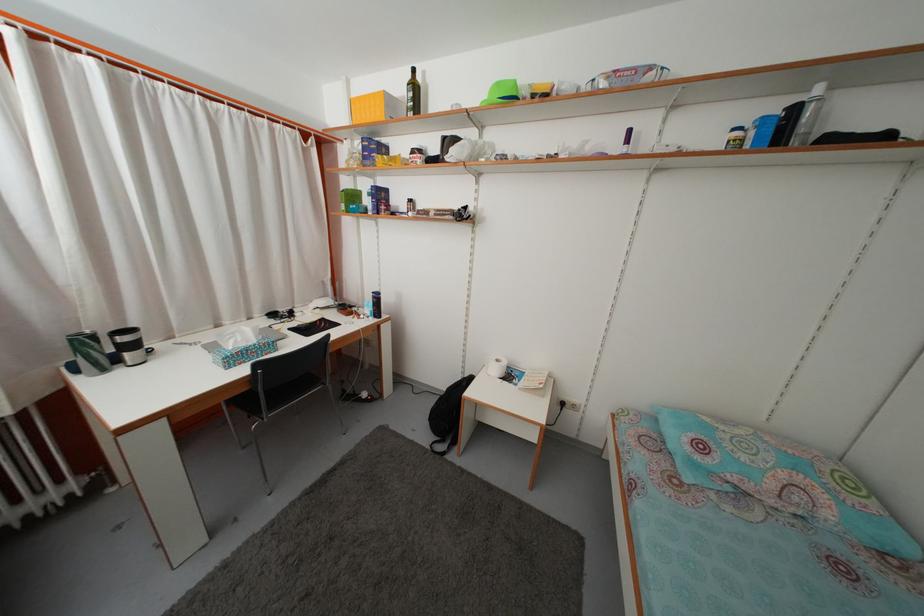
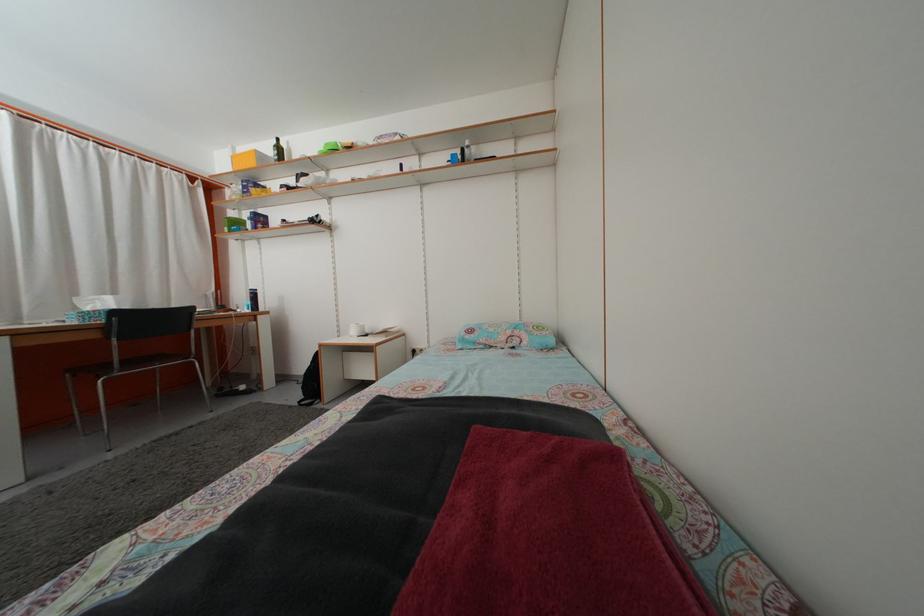
Locate, in the second image, the point that corresponds to (779,492) in the first image.

(508, 346)